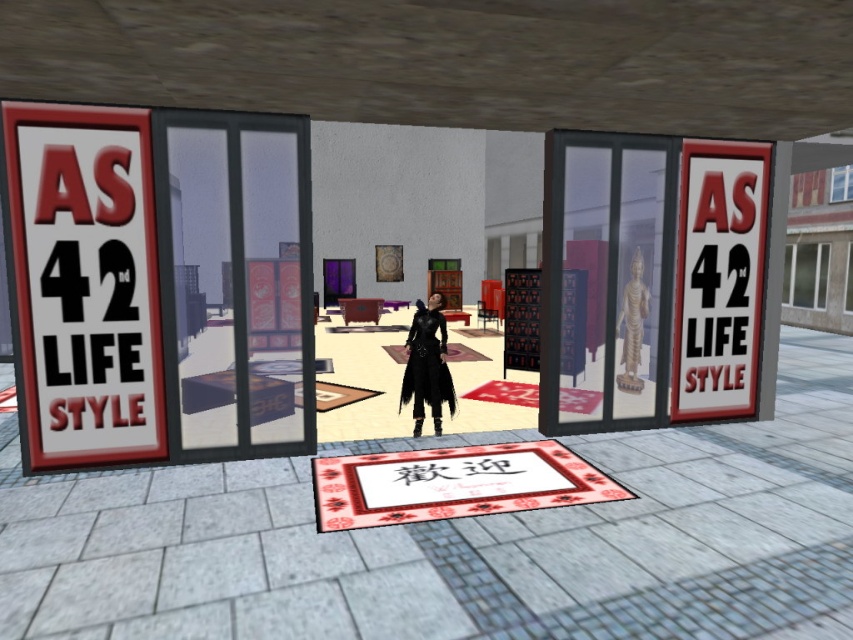
In the scene shown: Measure the distance between point (585, 356) and camera.

Point (585, 356) is 11.58 meters from camera.

Looking at this image, is transparent glass statue at center wider than matte black coat at center?

Yes.

In order to click on transparent glass statue at center in this screenshot , I will do `click(605, 280)`.

Find the location of a particular element. The image size is (853, 640). transparent glass statue at center is located at coordinates (605, 280).

Can you confirm if transparent glass door at center is positioned above transparent glass statue at center?

No.

Which is in front, point (247, 376) or point (650, 360)?

Positioned in front is point (247, 376).

Between point (294, 308) and point (560, 426), which one is positioned behind?

The point (560, 426) is behind.

The height and width of the screenshot is (640, 853). What are the coordinates of `transparent glass door at center` in the screenshot? It's located at (x=238, y=282).

Does white paper sign at left appear on the left side of matte black coat at center?

Indeed, white paper sign at left is positioned on the left side of matte black coat at center.

Which of these two, white paper sign at left or matte black coat at center, stands shorter?

With less height is matte black coat at center.

Who is more forward, (x=84, y=106) or (x=442, y=381)?

Point (x=84, y=106)

I want to click on white paper sign at left, so click(x=85, y=284).